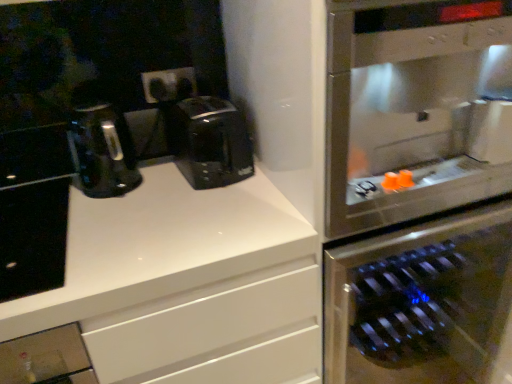
Question: Considering the positions of black matte cabinet at left and black plastic outlets at center in the image, is black matte cabinet at left wider or thinner than black plastic outlets at center?

Choices:
 (A) thin
 (B) wide

Answer: (B)

Question: In the image, is black matte cabinet at left on the left side or the right side of black plastic outlets at center?

Choices:
 (A) left
 (B) right

Answer: (A)

Question: Which of these objects is positioned farthest from the black plastic coffee maker at center?

Choices:
 (A) white glossy countertop at upper left
 (B) stainless steel wine cooler at right
 (C) stainless steel oven at right
 (D) black matte cabinet at left
 (E) black plastic outlets at center

Answer: (C)

Question: Estimate the real-world distances between objects in this image. Which object is closer to the stainless steel wine cooler at right?

Choices:
 (A) white glossy countertop at upper left
 (B) black plastic outlets at center
 (C) black matte cabinet at left
 (D) black plastic coffee maker at center
 (E) stainless steel oven at right

Answer: (E)